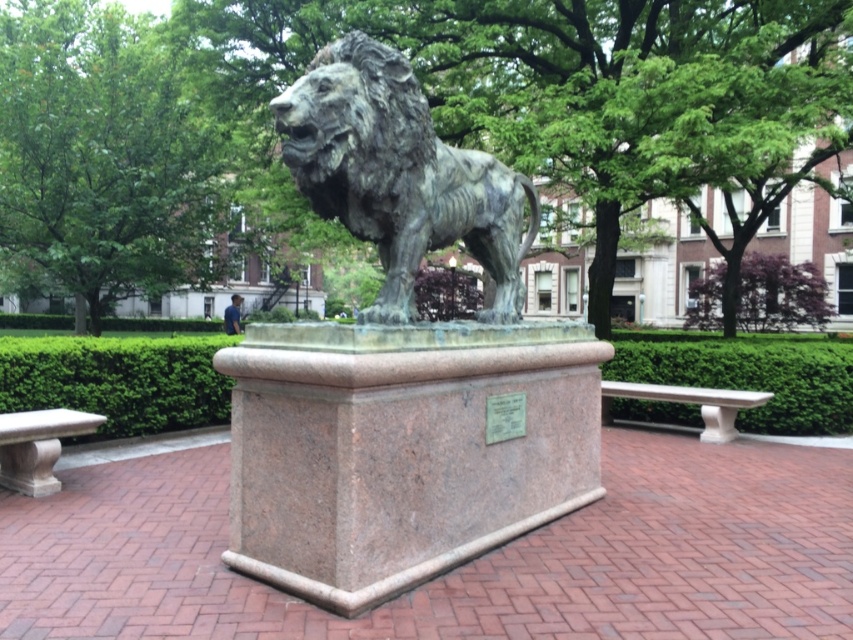
Can you confirm if bronze textured lion at center is shorter than green leafy hedge at lower left?

In fact, bronze textured lion at center may be taller than green leafy hedge at lower left.

Does bronze textured lion at center have a smaller size compared to green leafy hedge at lower left?

Yes.

What are the coordinates of `bronze textured lion at center` in the screenshot? It's located at (399, 176).

Between green leafy hedge at lower left and smooth stone bench at lower left, which one has more height?

Standing taller between the two is green leafy hedge at lower left.

Is point (187, 384) positioned in front of point (61, 419)?

No, it is behind (61, 419).

Where is `green leafy hedge at lower left`? Image resolution: width=853 pixels, height=640 pixels. green leafy hedge at lower left is located at coordinates [119, 380].

Where is `green leafy hedge at lower left`? green leafy hedge at lower left is located at coordinates (119, 380).

Is point (39, 385) positioned after point (624, 417)?

No, it is in front of (624, 417).

Is point (22, 410) positioned in front of point (750, 388)?

Yes, it is in front of point (750, 388).

In order to click on green leafy hedge at lower left in this screenshot , I will do `click(119, 380)`.